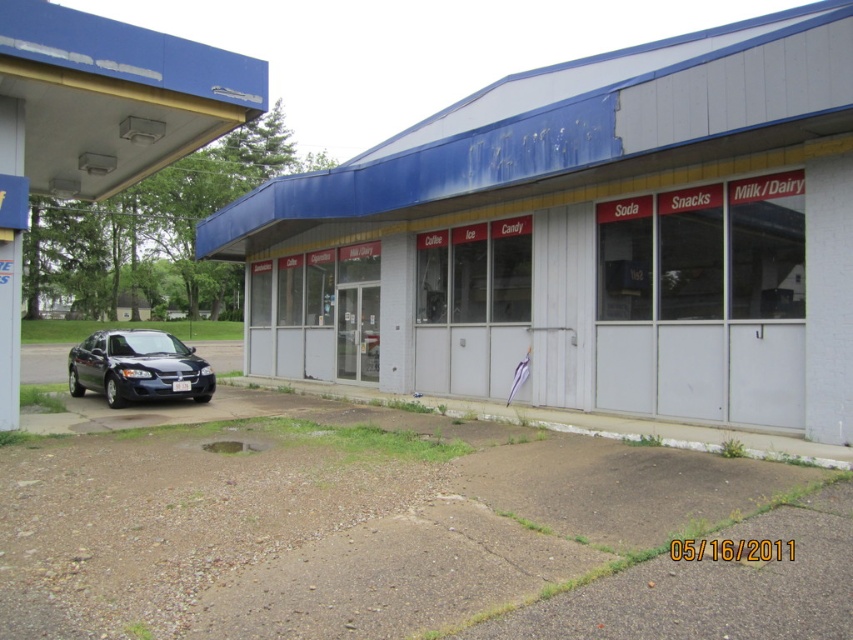
Measure the distance between white textured building at center and camera.

white textured building at center is 25.35 feet away from camera.

Is white textured building at center further to the viewer compared to shiny black sedan at lower left?

No.

Measure the distance between white textured building at center and camera.

The distance of white textured building at center from camera is 25.35 feet.

This screenshot has height=640, width=853. Identify the location of white textured building at center. (585, 237).

Can you confirm if metallic blue gas station at left is positioned to the left of shiny black sedan at lower left?

Incorrect, metallic blue gas station at left is not on the left side of shiny black sedan at lower left.

The image size is (853, 640). Find the location of `metallic blue gas station at left`. metallic blue gas station at left is located at coordinates (97, 124).

Locate an element on the screen. Image resolution: width=853 pixels, height=640 pixels. metallic blue gas station at left is located at coordinates (97, 124).

Who is taller, white textured building at center or metallic blue gas station at left?

white textured building at center is taller.

Which is behind, point (483, 212) or point (96, 113)?

Point (483, 212)

This screenshot has height=640, width=853. What do you see at coordinates (585, 237) in the screenshot?
I see `white textured building at center` at bounding box center [585, 237].

This screenshot has height=640, width=853. Identify the location of white textured building at center. (585, 237).